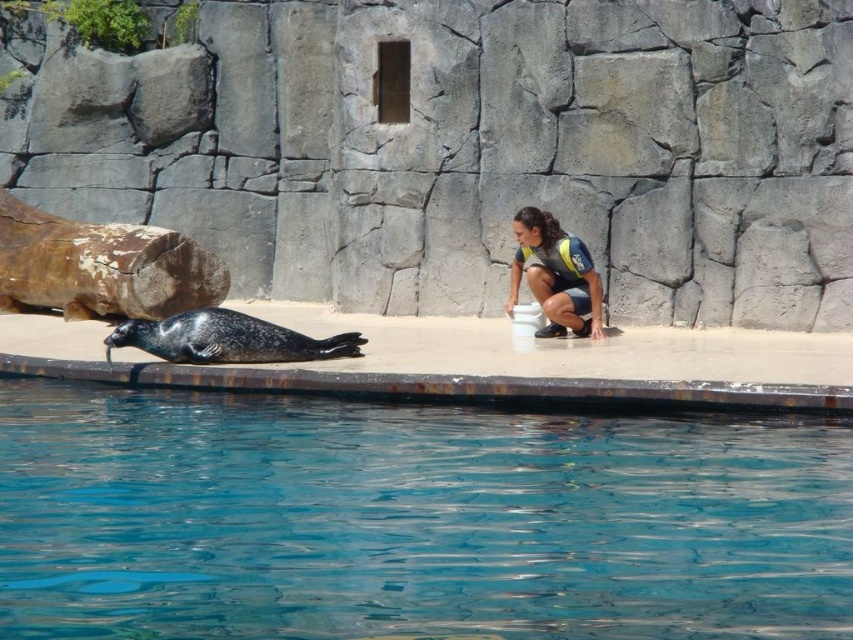
Question: Among these objects, which one is nearest to the camera?

Choices:
 (A) matte black wetsuit at center
 (B) gray fur seal at center

Answer: (B)

Question: Is the position of gray fur seal at center less distant than that of matte black wetsuit at center?

Choices:
 (A) no
 (B) yes

Answer: (B)

Question: Which of the following is the farthest from the observer?

Choices:
 (A) tap(521, 509)
 (B) tap(200, 355)

Answer: (B)

Question: Does transparent glass water at lower center have a greater width compared to matte black wetsuit at center?

Choices:
 (A) no
 (B) yes

Answer: (B)

Question: Is gray fur seal at center bigger than matte black wetsuit at center?

Choices:
 (A) yes
 (B) no

Answer: (B)

Question: Estimate the real-world distances between objects in this image. Which object is closer to the gray fur seal at center?

Choices:
 (A) transparent glass water at lower center
 (B) matte black wetsuit at center

Answer: (B)